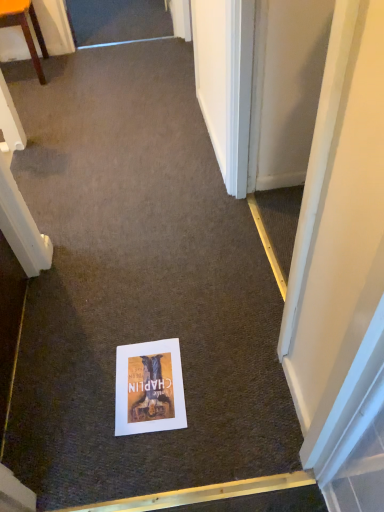
Where is `free location to the right of matte paper poster at center`? The image size is (384, 512). free location to the right of matte paper poster at center is located at coordinates (219, 383).